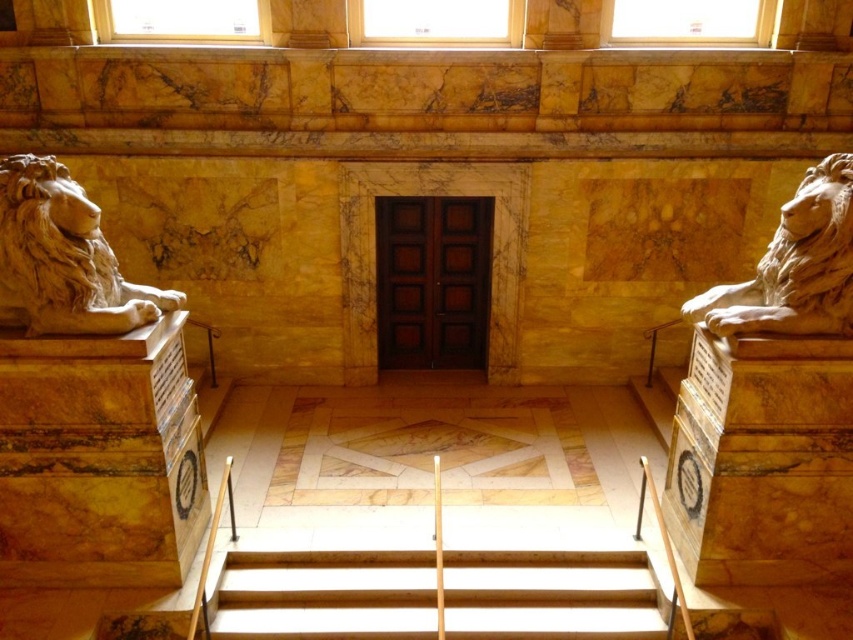
Question: Which point is farther to the camera?

Choices:
 (A) (764, 252)
 (B) (332, 596)
 (C) (143, 323)

Answer: (A)

Question: Is wooden stairs at center in front of white marble lion at left?

Choices:
 (A) yes
 (B) no

Answer: (B)

Question: Based on their relative distances, which object is farther from the white marble lion at left?

Choices:
 (A) white marble lion at right
 (B) wooden stairs at center

Answer: (A)

Question: Is white marble lion at left to the left of white marble lion at right from the viewer's perspective?

Choices:
 (A) no
 (B) yes

Answer: (B)

Question: Can you confirm if white marble lion at left is bigger than white marble lion at right?

Choices:
 (A) yes
 (B) no

Answer: (B)

Question: Which object is positioned farthest from the white marble lion at left?

Choices:
 (A) wooden stairs at center
 (B) white marble lion at right

Answer: (B)